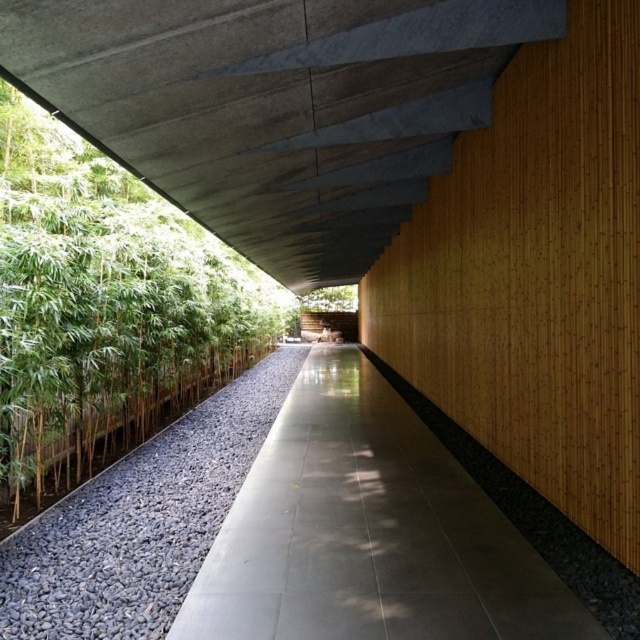
Question: Which object appears closest to the camera in this image?

Choices:
 (A) concrete ceiling at upper center
 (B) green bamboo at left

Answer: (A)

Question: From the image, what is the correct spatial relationship of black gravel at center in relation to green leafy tree at center?

Choices:
 (A) above
 (B) below

Answer: (B)

Question: Considering the real-world distances, which object is closest to the green leafy tree at center?

Choices:
 (A) black gravel at center
 (B) green bamboo at left

Answer: (B)

Question: Which point is closer to the camera taking this photo?

Choices:
 (A) (224, 60)
 (B) (172, 321)

Answer: (A)

Question: Is green bamboo at left positioned at the back of black gravel at center?

Choices:
 (A) yes
 (B) no

Answer: (A)

Question: Does gray concrete path at center come in front of black gravel at center?

Choices:
 (A) no
 (B) yes

Answer: (B)